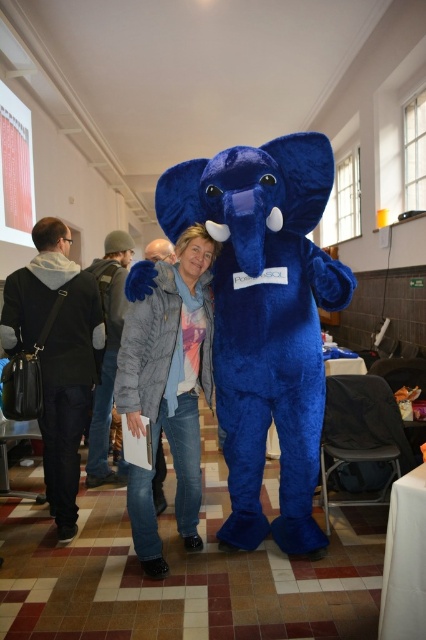
Based on the photo, you are organizing a photo shoot in the conference room. The blue plush elephant at center and the gray quilted jacket at center are both in the frame. Which object would appear larger in the photo?

The blue plush elephant at center would appear larger in the photo because it is bigger than the gray quilted jacket at center.